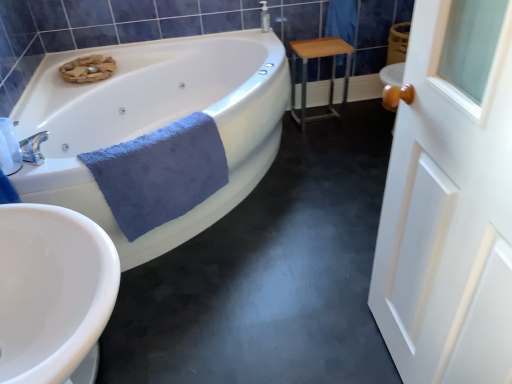
Where is `white wooden door at right`? This screenshot has height=384, width=512. white wooden door at right is located at coordinates (450, 200).

Describe the element at coordinates (307, 71) in the screenshot. The height and width of the screenshot is (384, 512). I see `light brown wood table at center right` at that location.

Identify the location of blue soft towel at lower left. (160, 173).

The image size is (512, 384). I want to click on white glossy electric kettle at left, so click(9, 148).

Identify the location of white wooden door at right. The width and height of the screenshot is (512, 384). (450, 200).

Which is more to the left, light brown wood table at center right or white glossy bathtub at upper left?

From the viewer's perspective, white glossy bathtub at upper left appears more on the left side.

Can we say light brown wood table at center right lies outside white glossy bathtub at upper left?

Indeed, light brown wood table at center right is completely outside white glossy bathtub at upper left.

Is light brown wood table at center right smaller than white glossy bathtub at upper left?

Yes, light brown wood table at center right is smaller than white glossy bathtub at upper left.

Can you confirm if light brown wood table at center right is wider than white glossy bathtub at upper left?

No.

From the picture: Between white wooden door at right and blue soft towel at lower left, which one has smaller size?

blue soft towel at lower left.

Is point (475, 62) positioned in front of point (130, 200)?

Yes, point (475, 62) is closer to viewer.

From the picture: Is white wooden door at right thinner than blue soft towel at lower left?

Yes.

From the image's perspective, which is above, blue soft towel at lower left or light brown wood table at center right?

light brown wood table at center right, from the image's perspective.

Is blue soft towel at lower left at the left side of light brown wood table at center right?

Yes, blue soft towel at lower left is to the left of light brown wood table at center right.

The image size is (512, 384). What are the coordinates of `table that is under the blue soft towel at lower left (from a real-world perspective)` in the screenshot? It's located at (307, 71).

Who is shorter, blue soft towel at lower left or light brown wood table at center right?

With less height is blue soft towel at lower left.

From a real-world perspective, is white wooden door at right physically located above or below white glossy electric kettle at left?

In terms of real-world spatial position, white wooden door at right is below white glossy electric kettle at left.

Is point (434, 323) behind point (11, 129)?

No, (434, 323) is in front of (11, 129).

Looking at this image, is white wooden door at right facing towards white glossy electric kettle at left?

No, white wooden door at right is not aimed at white glossy electric kettle at left.

Are white wooden door at right and white glossy electric kettle at left making contact?

No, white wooden door at right is not beside white glossy electric kettle at left.

The height and width of the screenshot is (384, 512). Identify the location of table above the white glossy electric kettle at left (from the image's perspective). coord(307,71).

Is light brown wood table at center right oriented towards white glossy electric kettle at left?

No, light brown wood table at center right is not aimed at white glossy electric kettle at left.

Is point (311, 43) closer to viewer compared to point (22, 159)?

That is False.

In terms of height, does light brown wood table at center right look taller or shorter compared to white glossy electric kettle at left?

Clearly, light brown wood table at center right is taller compared to white glossy electric kettle at left.

Is white glossy bathtub at upper left at the left side of blue soft towel at lower left?

Correct, you'll find white glossy bathtub at upper left to the left of blue soft towel at lower left.

In the scene shown: From a real-world perspective, which object stands above the other?

From a 3D spatial view, blue soft towel at lower left is above.

From the picture: Is white glossy bathtub at upper left bigger or smaller than blue soft towel at lower left?

white glossy bathtub at upper left is bigger than blue soft towel at lower left.

Choose the correct answer: Is white glossy bathtub at upper left inside blue soft towel at lower left or outside it?

white glossy bathtub at upper left cannot be found inside blue soft towel at lower left.

Is white glossy bathtub at upper left wider or thinner than white glossy electric kettle at left?

Clearly, white glossy bathtub at upper left has more width compared to white glossy electric kettle at left.

From the picture: From the image's perspective, which one is positioned lower, white glossy bathtub at upper left or white glossy electric kettle at left?

white glossy electric kettle at left is shown below in the image.

Who is smaller, white glossy bathtub at upper left or white glossy electric kettle at left?

white glossy electric kettle at left.

Where is `bathtub that appears above the light brown wood table at center right (from a real-world perspective)`? bathtub that appears above the light brown wood table at center right (from a real-world perspective) is located at coordinates click(x=156, y=123).

I want to click on door located on the right of blue soft towel at lower left, so click(450, 200).

Based on their spatial positions, is blue soft towel at lower left or white glossy bathtub at upper left further from white wooden door at right?

The object further to white wooden door at right is white glossy bathtub at upper left.

When comparing their distances from white wooden door at right, does blue soft towel at lower left or white glossy electric kettle at left seem closer?

blue soft towel at lower left is closer to white wooden door at right.

When comparing their distances from white glossy electric kettle at left, does white wooden door at right or white glossy bathtub at upper left seem further?

white wooden door at right is positioned further to the anchor white glossy electric kettle at left.

From the image, which object appears to be nearer to white glossy bathtub at upper left, light brown wood table at center right or white glossy electric kettle at left?

The object closer to white glossy bathtub at upper left is white glossy electric kettle at left.

Estimate the real-world distances between objects in this image. Which object is closer to white glossy electric kettle at left, light brown wood table at center right or blue soft towel at lower left?

The object closer to white glossy electric kettle at left is blue soft towel at lower left.

Which object lies further to the anchor point white glossy electric kettle at left, blue soft towel at lower left or white wooden door at right?

white wooden door at right is further to white glossy electric kettle at left.

Based on their spatial positions, is blue soft towel at lower left or light brown wood table at center right further from white glossy electric kettle at left?

light brown wood table at center right lies further to white glossy electric kettle at left than the other object.

When comparing their distances from white glossy electric kettle at left, does white glossy bathtub at upper left or white wooden door at right seem further?

Based on the image, white wooden door at right appears to be further to white glossy electric kettle at left.

Locate an element on the screen. bathtub between blue soft towel at lower left and light brown wood table at center right from front to back is located at coordinates (156, 123).

Locate an element on the screen. toiletry between white wooden door at right and light brown wood table at center right along the z-axis is located at coordinates (9, 148).

Locate an element on the screen. bathtub between white glossy electric kettle at left and light brown wood table at center right is located at coordinates (156, 123).

The height and width of the screenshot is (384, 512). I want to click on bath towel situated between white glossy electric kettle at left and white wooden door at right from left to right, so click(x=160, y=173).